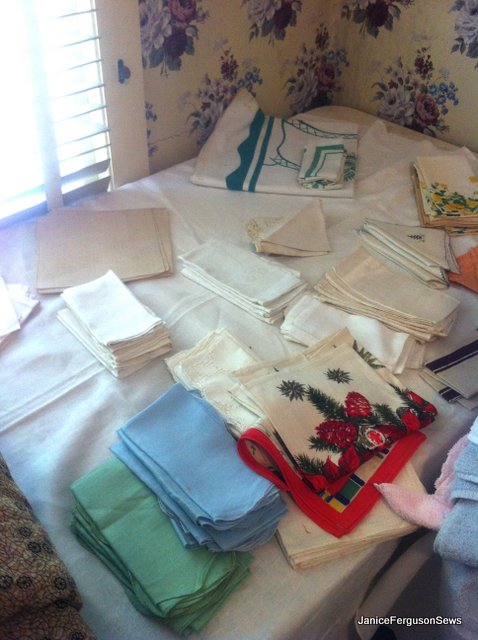
This screenshot has height=640, width=478. I want to click on wall, so click(x=425, y=80).